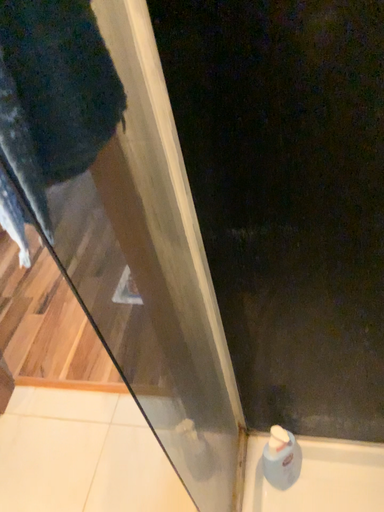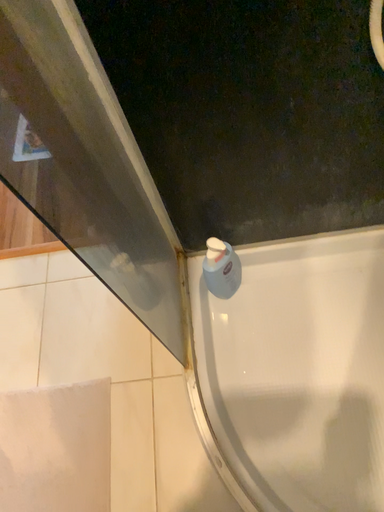
Question: How did the camera likely rotate when shooting the video?

Choices:
 (A) rotated right
 (B) rotated left

Answer: (A)